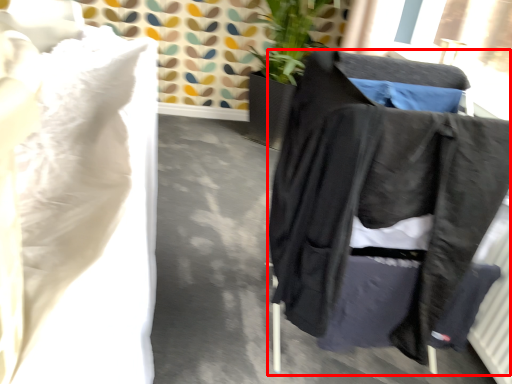
Question: From the image's perspective, considering the relative positions of furniture (annotated by the red box) and sheet in the image provided, where is furniture (annotated by the red box) located with respect to the staircase?

Choices:
 (A) below
 (B) above

Answer: (A)